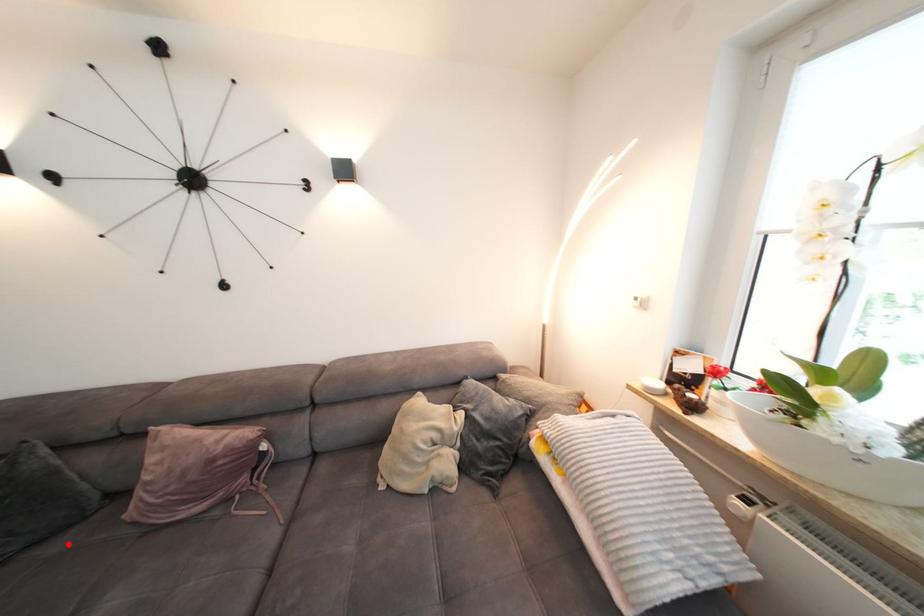
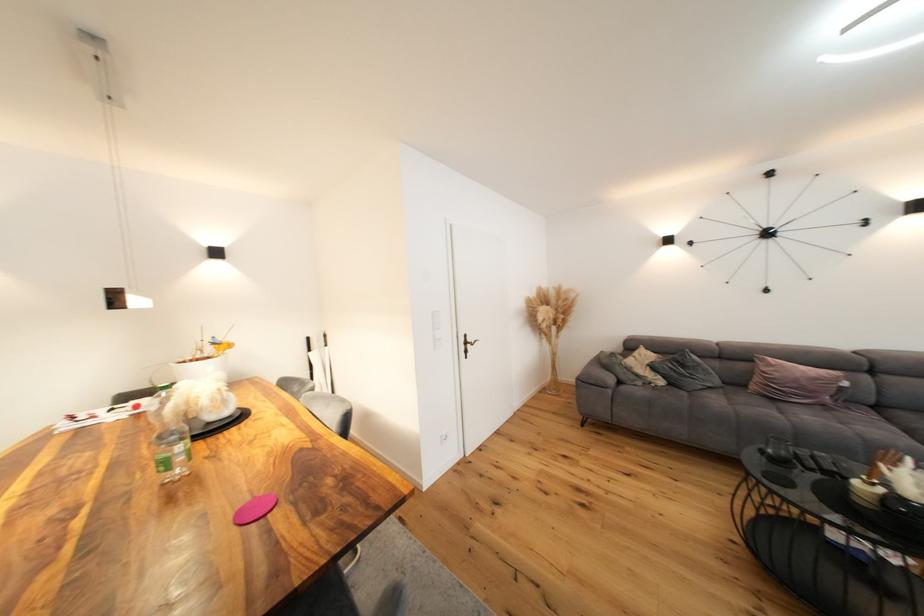
The point at the highlighted location is marked in the first image. Where is the corresponding point in the second image?

(727, 392)